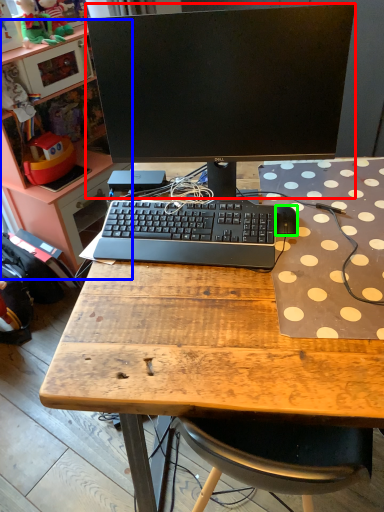
Question: Which is farther away from computer monitor (highlighted by a red box)? bookshelf (highlighted by a blue box) or mouse (highlighted by a green box)?

Choices:
 (A) bookshelf
 (B) mouse

Answer: (A)